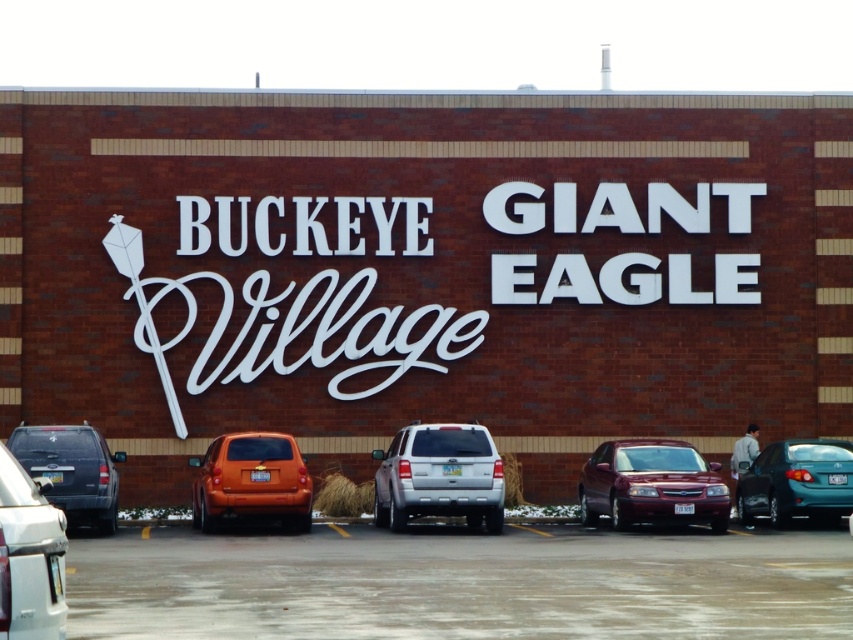
Does gray asphalt parking lot at lower center lie in front of silver metallic suv at lower left?

That is False.

Which is behind, point (689, 573) or point (55, 528)?

Positioned behind is point (689, 573).

Is point (643, 612) positioned in front of point (0, 483)?

That is False.

Locate an element on the screen. gray asphalt parking lot at lower center is located at coordinates (461, 582).

Does gray asphalt parking lot at lower center have a greater width compared to silver metallic suv at center?

Indeed, gray asphalt parking lot at lower center has a greater width compared to silver metallic suv at center.

Does gray asphalt parking lot at lower center appear under silver metallic suv at center?

Yes, gray asphalt parking lot at lower center is below silver metallic suv at center.

What do you see at coordinates (461, 582) in the screenshot? I see `gray asphalt parking lot at lower center` at bounding box center [461, 582].

You are a GUI agent. You are given a task and a screenshot of the screen. Output one action in this format:
    pyautogui.click(x=<x>, y=<y>)
    Task: Click on the gray asphalt parking lot at lower center
    
    Given the screenshot: What is the action you would take?
    pyautogui.click(x=461, y=582)

Is shiny maroon sedan at center below matte black suv at left?

Yes.

Can you confirm if shiny maroon sedan at center is positioned to the right of matte black suv at left?

Correct, you'll find shiny maroon sedan at center to the right of matte black suv at left.

Does point (680, 440) come closer to viewer compared to point (77, 497)?

No, it is not.

You are a GUI agent. You are given a task and a screenshot of the screen. Output one action in this format:
    pyautogui.click(x=<x>, y=<y>)
    Task: Click on the shiny maroon sedan at center
    
    Given the screenshot: What is the action you would take?
    pyautogui.click(x=653, y=484)